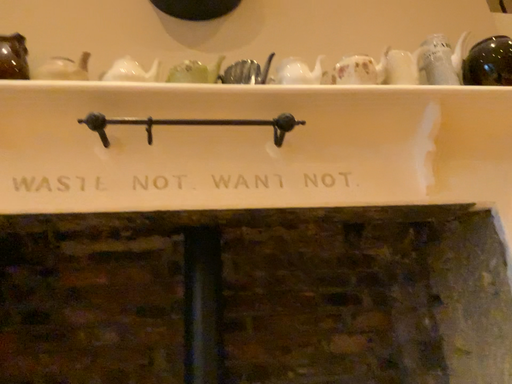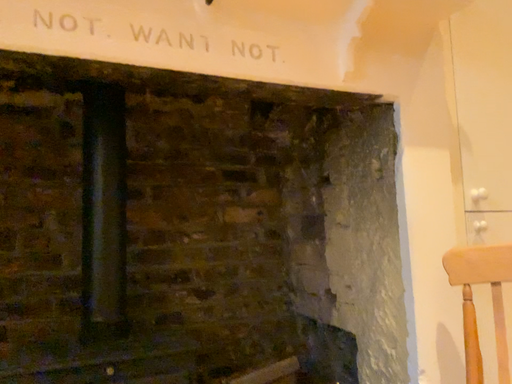
Question: How did the camera likely rotate when shooting the video?

Choices:
 (A) rotated left
 (B) rotated right

Answer: (B)